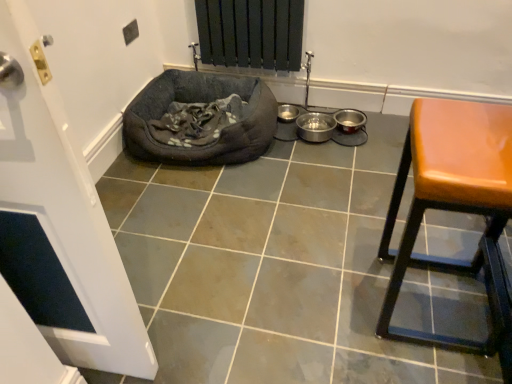
Image resolution: width=512 pixels, height=384 pixels. What are the coordinates of `vacant area located to the right-hand side of dark gray fabric dog bed at lower left` in the screenshot? It's located at (x=330, y=166).